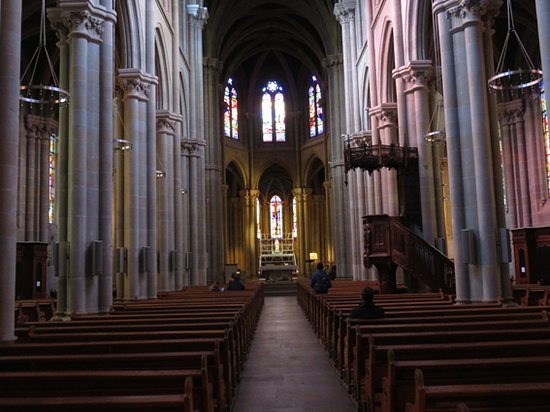
This screenshot has height=412, width=550. In order to click on confessionals in this screenshot , I will do click(35, 281), click(532, 265).